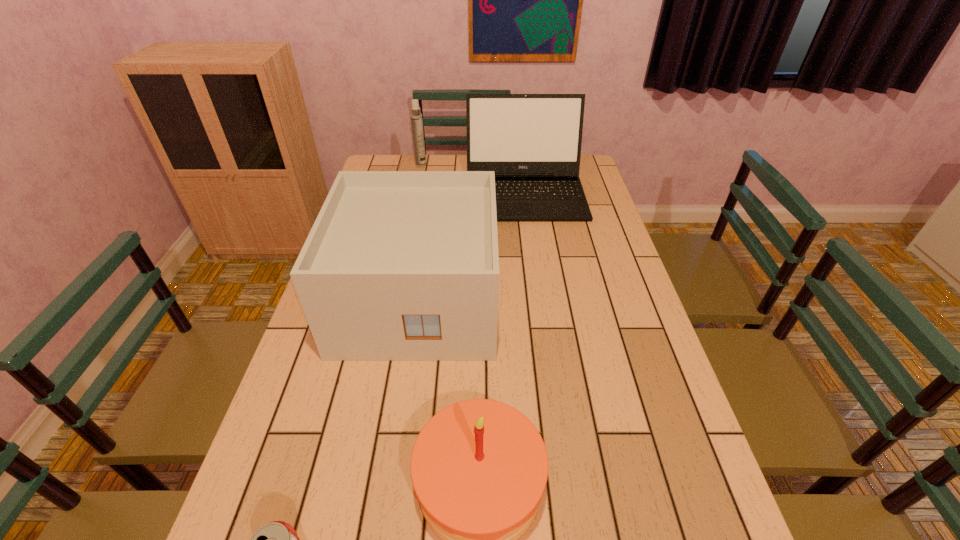
Where is `object positioned at the far right corner`? The height and width of the screenshot is (540, 960). object positioned at the far right corner is located at coordinates (532, 142).

Locate an element on the screen. The width and height of the screenshot is (960, 540). vacant space at the left edge is located at coordinates (252, 478).

At what (x,y) coordinates should I click in order to perform the action: click on vacant point at the right edge. Please return your answer as a coordinate pair (x, y). Looking at the image, I should click on (611, 234).

In order to click on vacant space at the far right corner in this screenshot , I will do `click(586, 176)`.

Select which object is the closest to the birthday cake. Please provide its 2D coordinates. Your answer should be formatted as a tuple, i.e. [(x, y)], where the tuple contains the x and y coordinates of a point satisfying the conditions above.

[(278, 539)]

Identify which object is the third closest to the birthday cake. Please provide its 2D coordinates. Your answer should be formatted as a tuple, i.e. [(x, y)], where the tuple contains the x and y coordinates of a point satisfying the conditions above.

[(532, 142)]